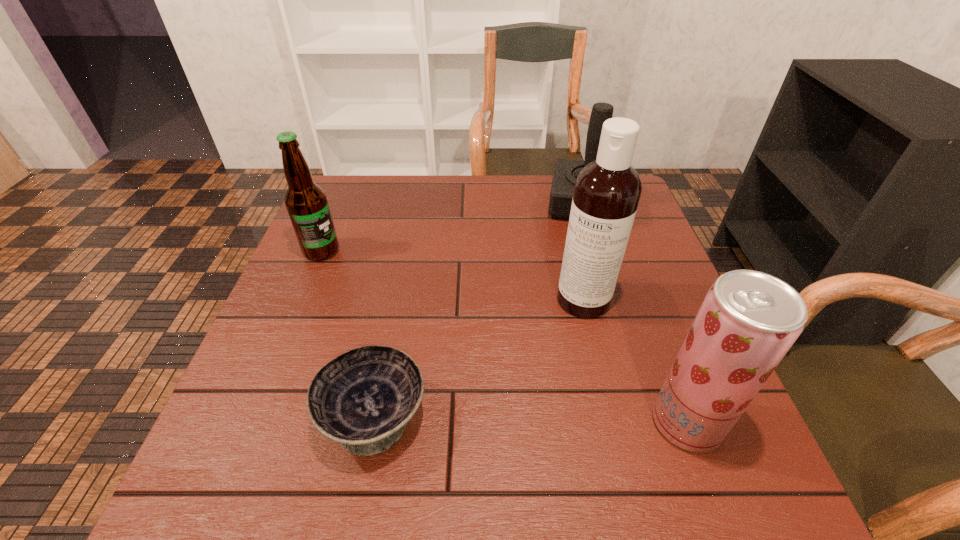
Where is `empty space between the second farthest object and the fruit juice`? empty space between the second farthest object and the fruit juice is located at coordinates (504, 336).

Identify which object is the second closest to the beer bottle. Please provide its 2D coordinates. Your answer should be formatted as a tuple, i.e. [(x, y)], where the tuple contains the x and y coordinates of a point satisfying the conditions above.

[(607, 191)]

Find the location of a particular element. This screenshot has height=540, width=960. object identified as the closest to the dishwasher detergent is located at coordinates (748, 321).

Where is `free region that satisfies the following two spatial constraints: 1. on the back side of the dishwasher detergent; 2. on the right side of the farthest object`? The height and width of the screenshot is (540, 960). free region that satisfies the following two spatial constraints: 1. on the back side of the dishwasher detergent; 2. on the right side of the farthest object is located at coordinates (561, 205).

The height and width of the screenshot is (540, 960). In order to click on free point that satisfies the following two spatial constraints: 1. on the back side of the leftmost object; 2. on the right side of the joystick in this screenshot , I will do `click(341, 205)`.

Image resolution: width=960 pixels, height=540 pixels. In order to click on free spot that satisfies the following two spatial constraints: 1. on the back side of the bowl; 2. on the right side of the joystick in this screenshot , I will do `click(415, 205)`.

Find the location of a particular element. The width and height of the screenshot is (960, 540). vacant region that satisfies the following two spatial constraints: 1. on the front side of the bowl; 2. on the left side of the fourth nearest object is located at coordinates (253, 416).